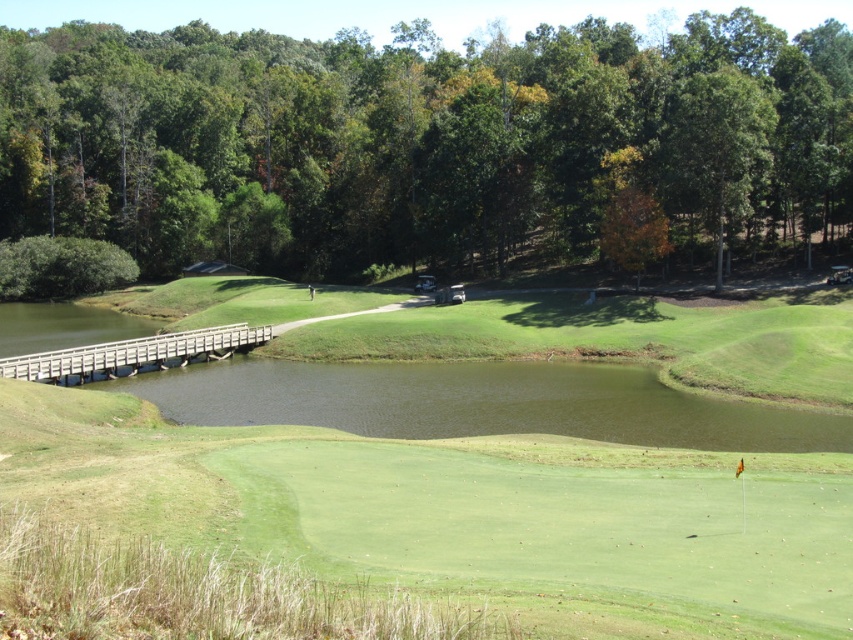
Is point (183, 339) less distant than point (612, 240)?

Yes, it is in front of point (612, 240).

Which is more to the left, wooden bridge at lower left or orange leafy tree at upper center?

wooden bridge at lower left is more to the left.

Which is in front, point (231, 330) or point (608, 209)?

Point (231, 330)

This screenshot has height=640, width=853. In order to click on wooden bridge at lower left in this screenshot , I will do 132,355.

Based on the photo, which is more to the left, green grassy golf course at center or orange leafy tree at upper center?

From the viewer's perspective, green grassy golf course at center appears more on the left side.

Consider the image. Is the position of green grassy golf course at center more distant than that of orange leafy tree at upper center?

No, green grassy golf course at center is in front of orange leafy tree at upper center.

Who is more distant from viewer, [80,424] or [602,236]?

The point [602,236] is more distant.

The image size is (853, 640). Find the location of `green grassy golf course at center`. green grassy golf course at center is located at coordinates (463, 515).

Is green leafy trees at upper center positioned at the back of green grassy golf course at center?

That is True.

Does green leafy trees at upper center appear under green grassy golf course at center?

No.

Is point (77, 145) positioned in front of point (556, 390)?

No, (77, 145) is further to viewer.

Identify the location of green leafy trees at upper center. (418, 140).